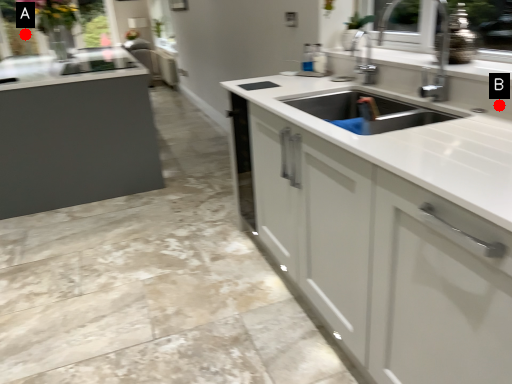
Question: Two points are circled on the image, labeled by A and B beside each circle. Which point is farther from the camera taking this photo?

Choices:
 (A) A is further
 (B) B is further

Answer: (A)